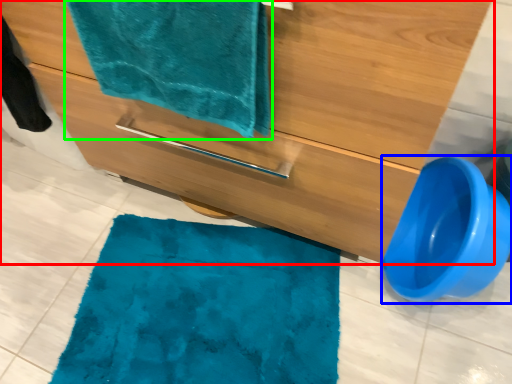
Question: Which is farther away from bathroom cabinet (highlighted by a red box)? toilet bowl (highlighted by a blue box) or towel (highlighted by a green box)?

Choices:
 (A) toilet bowl
 (B) towel

Answer: (A)